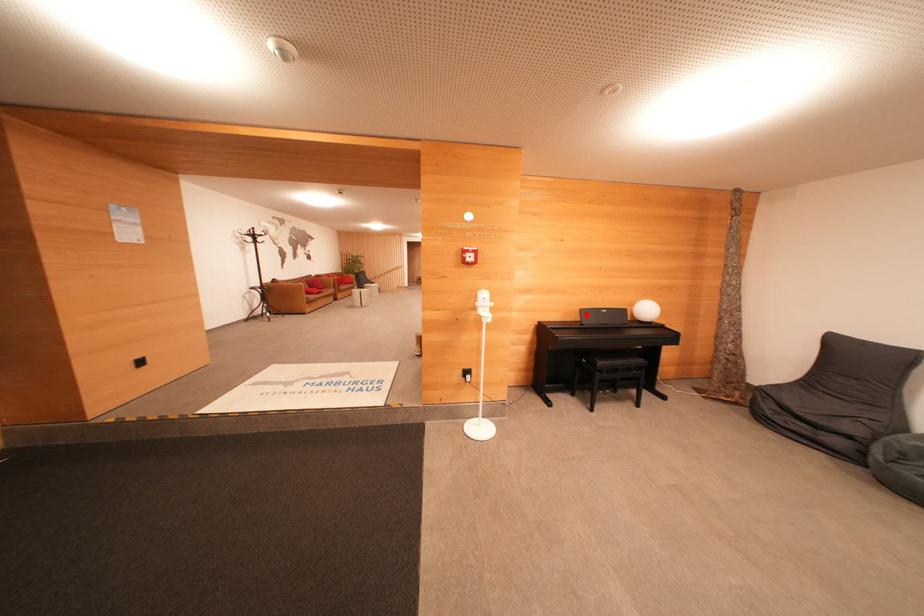
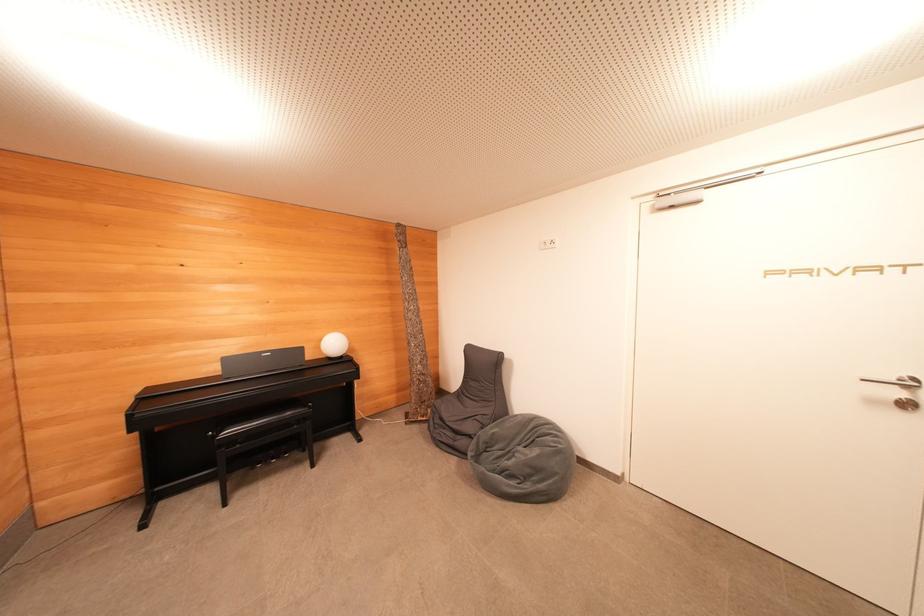
Where in the second image is the point corresponding to the highlighted location from the first image?

(229, 363)